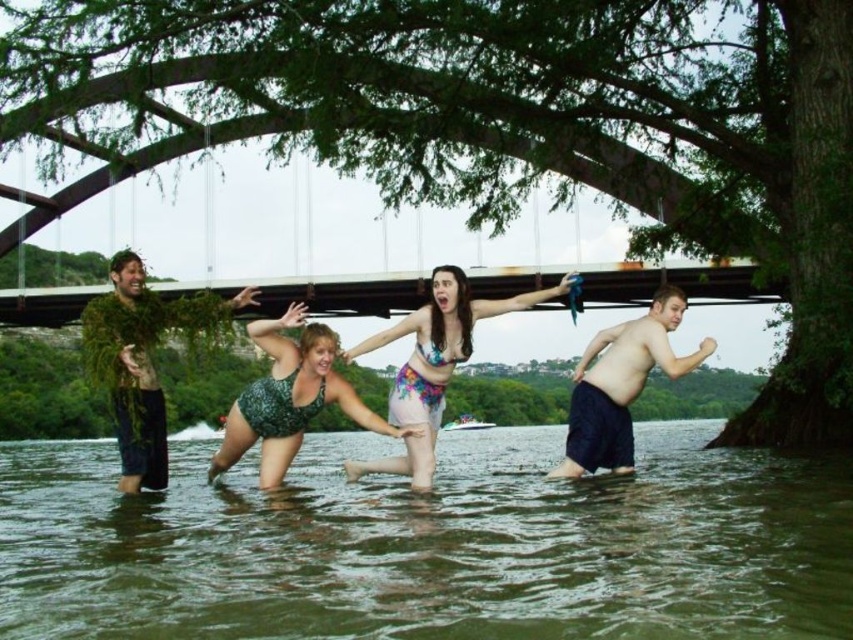
Question: Among these points, which one is nearest to the camera?

Choices:
 (A) (706, 269)
 (B) (567, 460)
 (C) (413, 397)
 (D) (209, 298)

Answer: (B)

Question: Which object appears closest to the camera in this image?

Choices:
 (A) floral fabric bikini at center
 (B) rusty metal bridge at center
 (C) dark blue cotton shorts at right

Answer: (A)

Question: Can you confirm if greenish murky water at lower center is positioned below green leafy plant at left?

Choices:
 (A) no
 (B) yes

Answer: (B)

Question: Among these objects, which one is farthest from the camera?

Choices:
 (A) greenish murky water at lower center
 (B) green leafy plant at left
 (C) rusty metal bridge at center

Answer: (C)

Question: Does green leafy tree at center have a larger size compared to rusty metal bridge at center?

Choices:
 (A) no
 (B) yes

Answer: (B)

Question: Considering the relative positions of floral fabric bikini at center and dark blue cotton shorts at right in the image provided, where is floral fabric bikini at center located with respect to dark blue cotton shorts at right?

Choices:
 (A) below
 (B) above

Answer: (B)